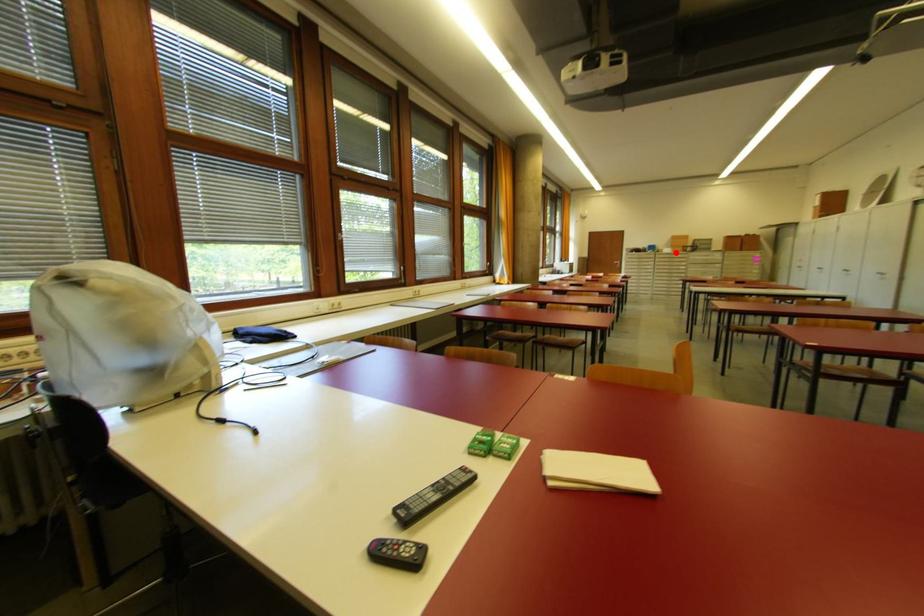
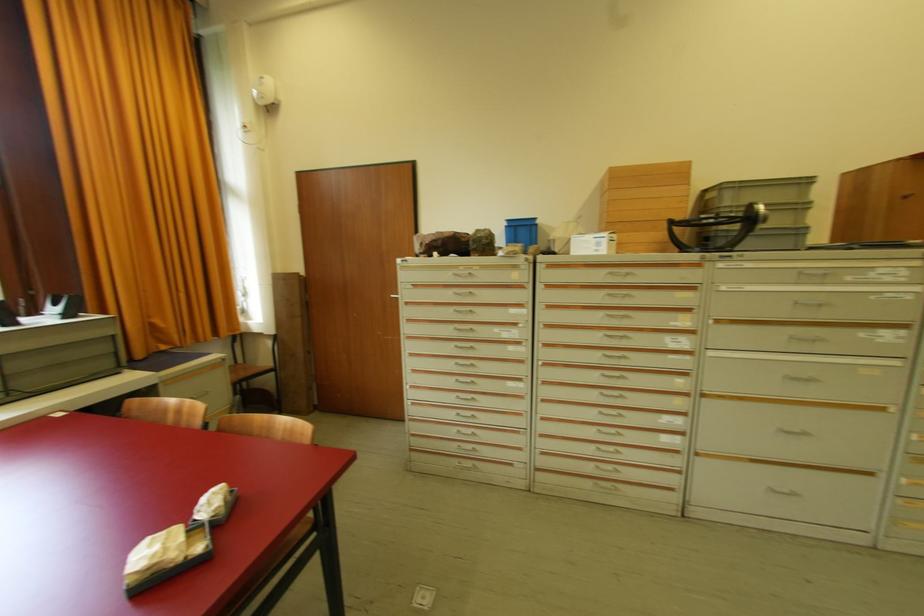
Question: I am providing you with two images of the same scene from different viewpoints. A red point is marked on the first image. Can you still see the location of the red point in image 2?

Choices:
 (A) Yes
 (B) No

Answer: (A)